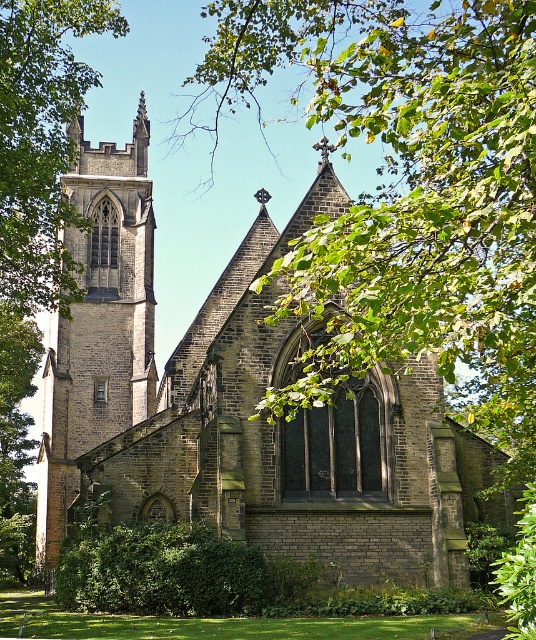
Is brown stone church at center taller than brown stone tower at left?

No.

Between brown stone church at center and brown stone tower at left, which one appears on the left side from the viewer's perspective?

brown stone tower at left

At what (x,y) coordinates should I click in order to perform the action: click on brown stone church at center. Please return your answer as a coordinate pair (x, y). The height and width of the screenshot is (640, 536). Looking at the image, I should click on (241, 406).

How distant is brown stone church at center from green leafy tree at left?

brown stone church at center and green leafy tree at left are 17.85 meters apart from each other.

Is point (487, 513) more distant than point (21, 284)?

That is False.

Which is behind, point (114, 522) or point (31, 221)?

The point (31, 221) is behind.

The height and width of the screenshot is (640, 536). What are the coordinates of `brown stone church at center` in the screenshot? It's located at (241, 406).

Which is below, brown stone tower at left or green leafy tree at left?

Positioned lower is brown stone tower at left.

Between brown stone tower at left and green leafy tree at left, which one appears on the right side from the viewer's perspective?

brown stone tower at left

Who is more forward, (132,404) or (79,1)?

Positioned in front is point (79,1).

The width and height of the screenshot is (536, 640). I want to click on brown stone tower at left, so click(99, 324).